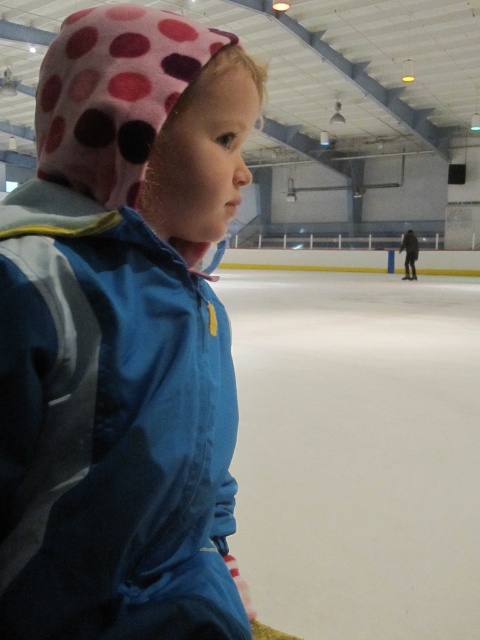
Question: Does blue fabric jacket at left come behind white smooth ice at center?

Choices:
 (A) yes
 (B) no

Answer: (B)

Question: Which object appears closest to the camera in this image?

Choices:
 (A) white smooth ice at center
 (B) blue fabric jacket at left

Answer: (B)

Question: Which point is farther to the camera?

Choices:
 (A) (396, 637)
 (B) (203, 316)

Answer: (A)

Question: Does blue fabric jacket at left come behind white smooth ice at center?

Choices:
 (A) no
 (B) yes

Answer: (A)

Question: Considering the relative positions of blue fabric jacket at left and white smooth ice at center in the image provided, where is blue fabric jacket at left located with respect to white smooth ice at center?

Choices:
 (A) below
 (B) above

Answer: (A)